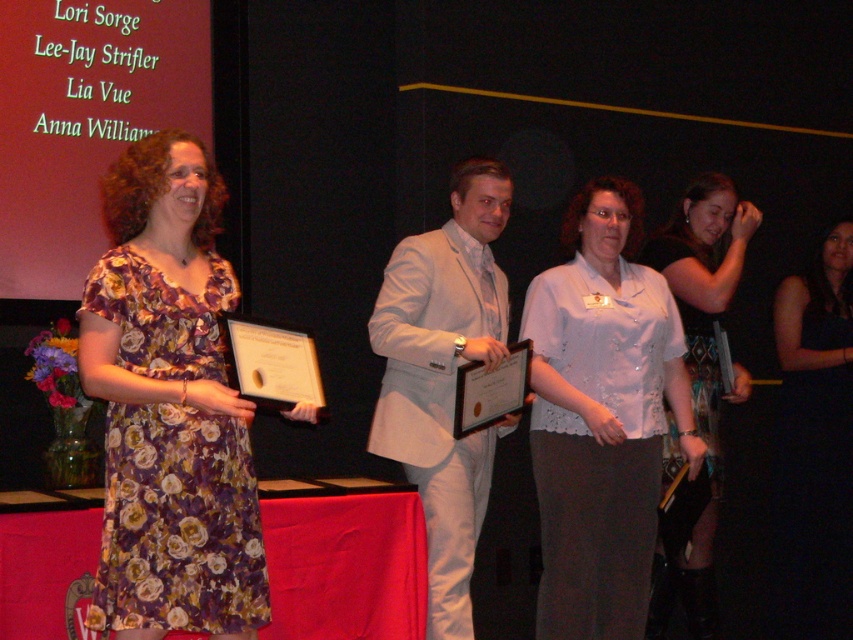
Question: Which point appears farthest from the camera in this image?

Choices:
 (A) (567, 372)
 (B) (198, 392)
 (C) (436, 589)
 (D) (714, 632)

Answer: (D)

Question: Which of the following is the farthest from the observer?

Choices:
 (A) floral dress at left
 (B) light gray suit at center

Answer: (B)

Question: Estimate the real-world distances between objects in this image. Which object is closer to the light gray suit at center?

Choices:
 (A) black satin dress at center
 (B) white lace blouse at center
 (C) black sequined dress at center
 (D) floral dress at left

Answer: (B)

Question: Can you confirm if light gray suit at center is positioned to the left of black sequined dress at center?

Choices:
 (A) no
 (B) yes

Answer: (B)

Question: From the image, what is the correct spatial relationship of white lace blouse at center in relation to light gray suit at center?

Choices:
 (A) below
 (B) above

Answer: (A)

Question: Does light gray suit at center appear over black satin dress at center?

Choices:
 (A) no
 (B) yes

Answer: (B)